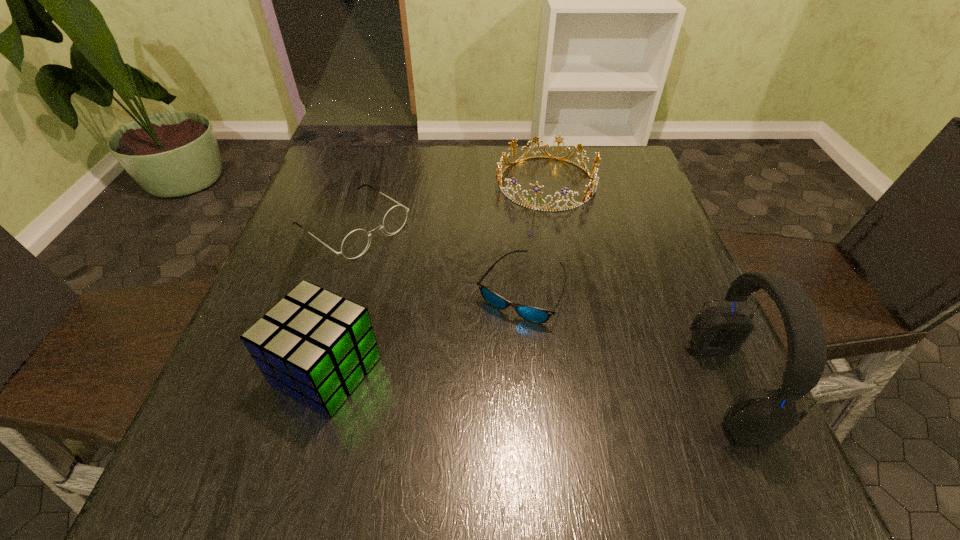
I want to click on cube that is at the left edge, so click(316, 346).

Locate an element on the screen. This screenshot has width=960, height=540. spectacles situated at the left edge is located at coordinates (355, 243).

This screenshot has height=540, width=960. Identify the location of headset situated at the right edge. (757, 417).

Identify the location of tiara positioned at the right edge. The height and width of the screenshot is (540, 960). (594, 180).

I want to click on object positioned at the far left corner, so click(355, 243).

Locate an element on the screen. object that is positioned at the near left corner is located at coordinates (316, 346).

This screenshot has width=960, height=540. I want to click on object at the far right corner, so click(594, 180).

You are a GUI agent. You are given a task and a screenshot of the screen. Output one action in this format:
    pyautogui.click(x=<x>, y=<y>)
    Task: Click on the object at the near right corner
    The image size is (960, 540).
    Given the screenshot: What is the action you would take?
    pyautogui.click(x=757, y=417)

The width and height of the screenshot is (960, 540). In the image, there is a desktop. What are the coordinates of `vacant region at the far edge` in the screenshot? It's located at (457, 170).

Find the location of a particular element. vacant space at the near edge is located at coordinates point(349,424).